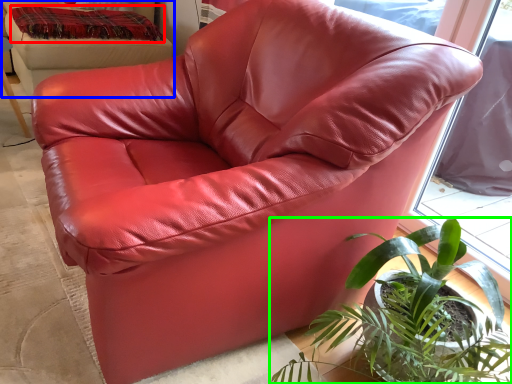
Question: Which object is positioned closest to blanket (highlighted by a red box)? Select from bean bag chair (highlighted by a blue box) and houseplant (highlighted by a green box).

Choices:
 (A) bean bag chair
 (B) houseplant

Answer: (A)